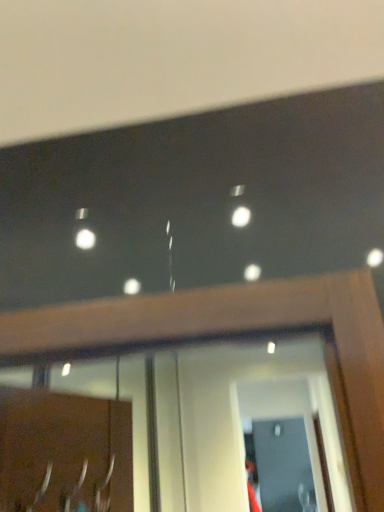
Question: From a real-world perspective, is clear glass screen door at lower center, which appears as the 1th screen door when viewed from the back, positioned above or below transparent glass screen door at lower center, the second screen door positioned from the bottom?

Choices:
 (A) below
 (B) above

Answer: (A)

Question: Is clear glass screen door at lower center, acting as the 2th screen door starting from the top, wider or thinner than transparent glass screen door at lower center, which appears as the first screen door when viewed from the front?

Choices:
 (A) wide
 (B) thin

Answer: (B)

Question: Which object is the farthest from the transparent glass screen door at lower center, which appears as the first screen door when viewed from the front?

Choices:
 (A) silver metallic door handle at lower left
 (B) clear glass screen door at lower center, marked as the first screen door in a bottom-to-top arrangement

Answer: (A)

Question: Which is nearer to the clear glass screen door at lower center, marked as the second screen door in a front-to-back arrangement?

Choices:
 (A) silver metallic door handle at lower left
 (B) transparent glass screen door at lower center, the second screen door positioned from the bottom

Answer: (B)